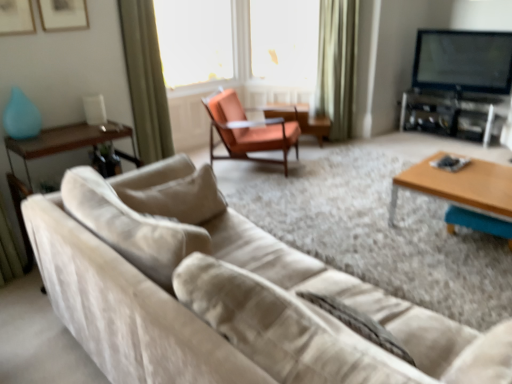
Question: Is flat-screen tv at upper right spatially inside green velvet curtain at upper center, positioned as the 2th curtain in front-to-back order, or outside of it?

Choices:
 (A) outside
 (B) inside

Answer: (A)

Question: Is point (495, 72) positioned closer to the camera than point (329, 13)?

Choices:
 (A) farther
 (B) closer

Answer: (A)

Question: Which is nearer to the wooden glossy side table at left, the 1th side table positioned from the front?

Choices:
 (A) metallic silver entertainment center at right
 (B) matte wood side table at center, marked as the first side table in a right-to-left arrangement
 (C) flat-screen tv at upper right
 (D) transparent plastic screen at upper center, acting as the 2th window screen starting from the left
 (E) green velvet curtain at upper center, which is counted as the second curtain, starting from the left

Answer: (B)

Question: Based on their relative distances, which object is nearer to the orange leather chair at center?

Choices:
 (A) green fabric curtain at upper left, arranged as the 2th curtain when viewed from the right
 (B) suede beige couch at lower left
 (C) flat-screen tv at upper right
 (D) wooden/matte coffee table at right
 (E) green velvet curtain at upper center, which is counted as the second curtain, starting from the left

Answer: (E)